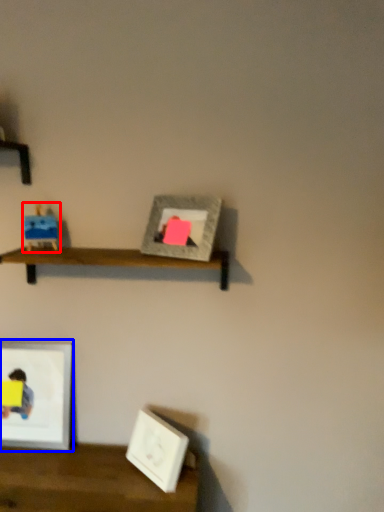
Question: Which point is closer to the camera, toy (highlighted by a red box) or picture frame (highlighted by a blue box)?

Choices:
 (A) toy
 (B) picture frame

Answer: (A)